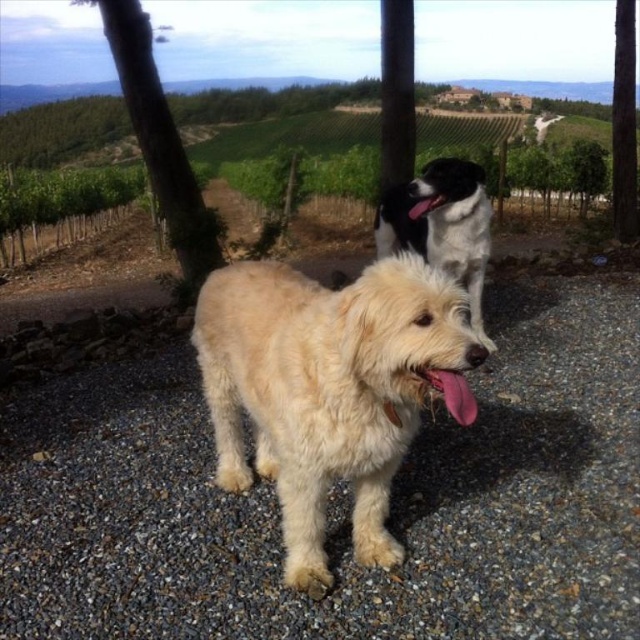
You are a photographer trying to capture both the white gravel at center and the black and white fur dog at upper center in a single shot. Based on their positions, which object is located to the left of the other?

The white gravel at center is positioned on the left side of black and white fur dog at upper center, so the white gravel at center is to the left of the black and white fur dog at upper center.

You are standing at the entrance of the vineyard path and want to approach the fuzzy beige dog at center. According to the coordinates provided, in which direction should you move relative to your current position?

The fuzzy beige dog at center is located at coordinates point (330, 388), so you should move forward along the path towards the center to reach it.